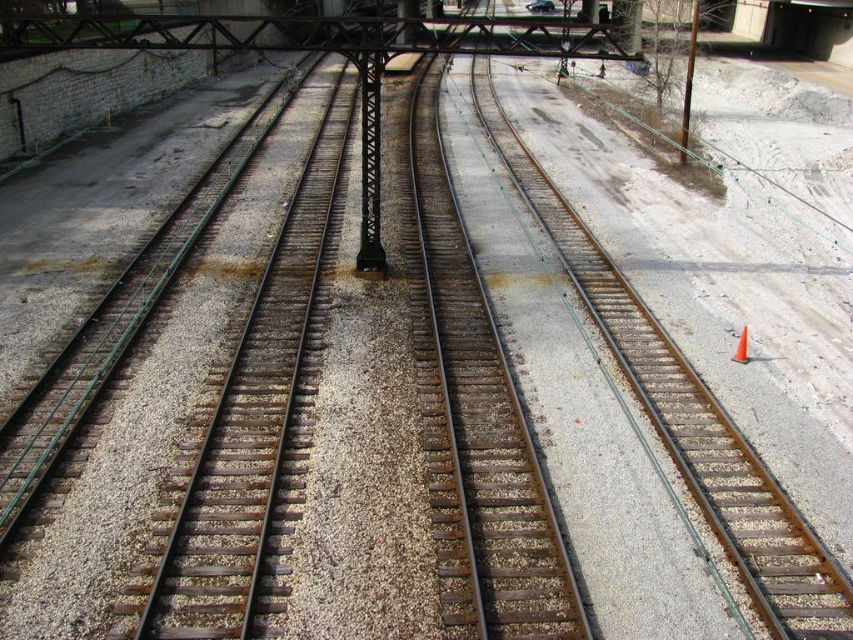
Is rusty metal bridge at upper center in front of orange plastic traffic cone at center-right?

No, it is not.

Could you measure the distance between rusty metal bridge at upper center and orange plastic traffic cone at center-right?

The distance of rusty metal bridge at upper center from orange plastic traffic cone at center-right is 35.57 meters.

Find the location of a particular element. rusty metal bridge at upper center is located at coordinates point(316,35).